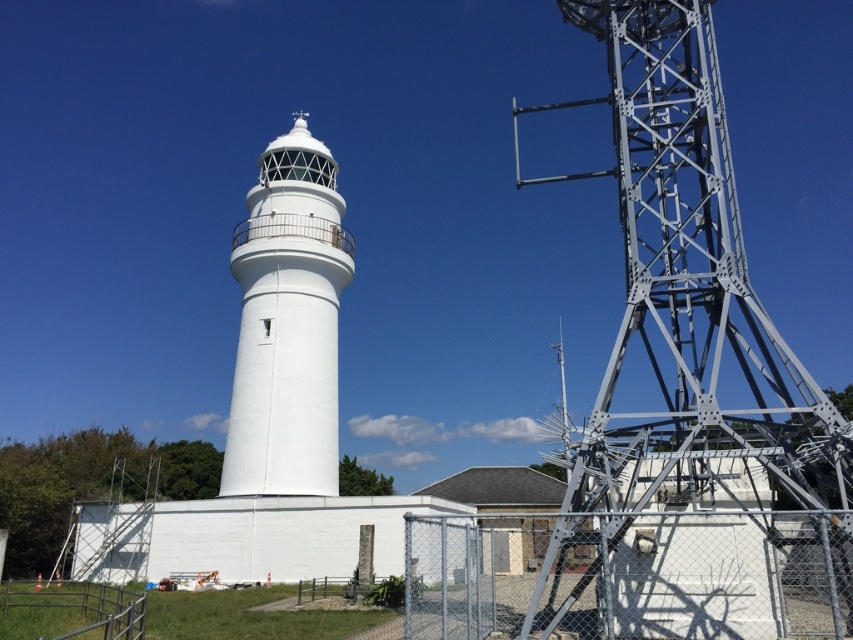
You are a bird flying over the coastal area. You see the metallic gray tower at right and the white smooth lighthouse at center. Which structure is positioned lower in the sky?

The metallic gray tower at right is below the white smooth lighthouse at center, so it is positioned lower in the sky.

You are standing at the origin point of the image. You see two points marked in the scene. Which point is closer to you, point (663,348) or point (302,340)?

Point (302,340) is closer to you because it is in front of point (663,348).